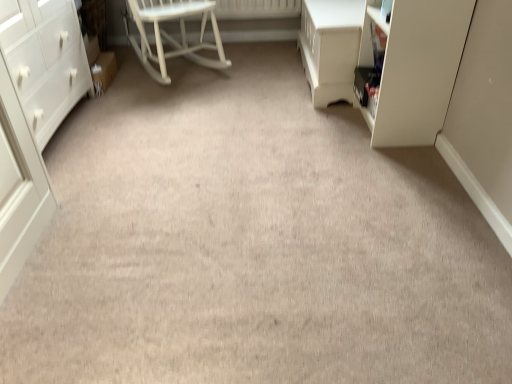
Find the location of a particular element. The height and width of the screenshot is (384, 512). vacant area that lies between white wood rocking chair at center and matte white cabinet at right is located at coordinates (259, 93).